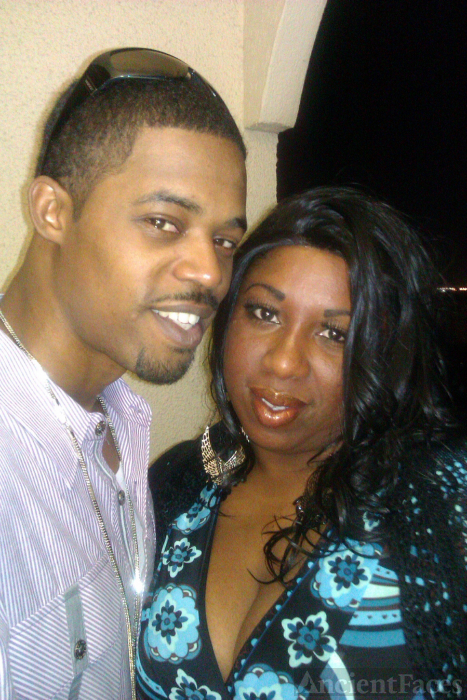
The height and width of the screenshot is (700, 467). Identify the location of arch doorway. (296, 40).